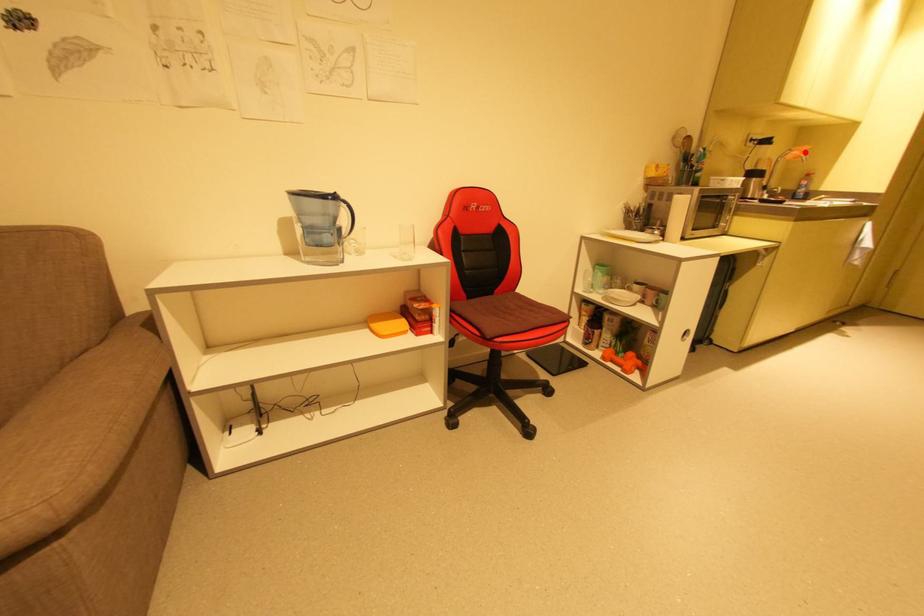
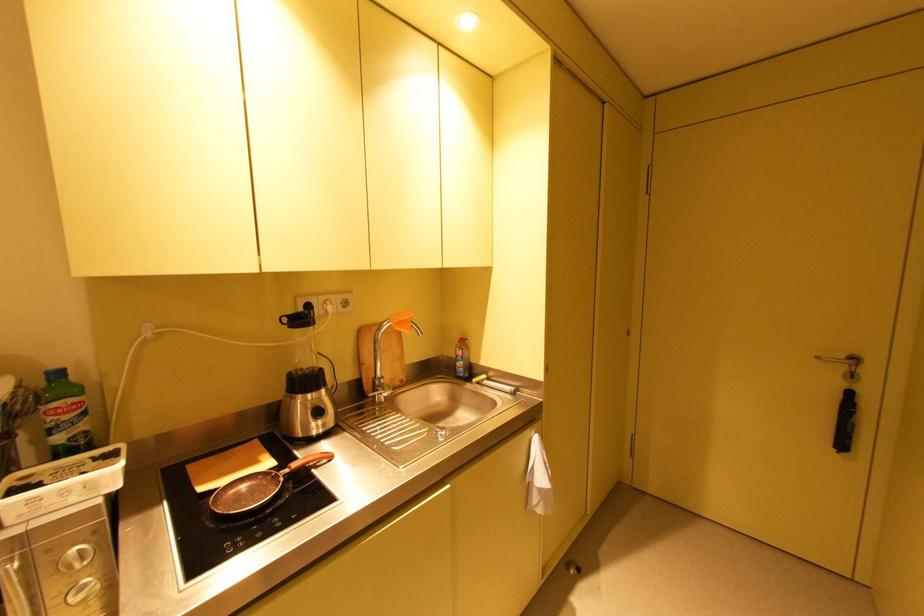
Question: I am providing you with two images of the same scene from different viewpoints. In image1, a red point is highlighted. Considering the same 3D point in image2, which of the following is correct?

Choices:
 (A) It is closer
 (B) It is farther

Answer: (A)